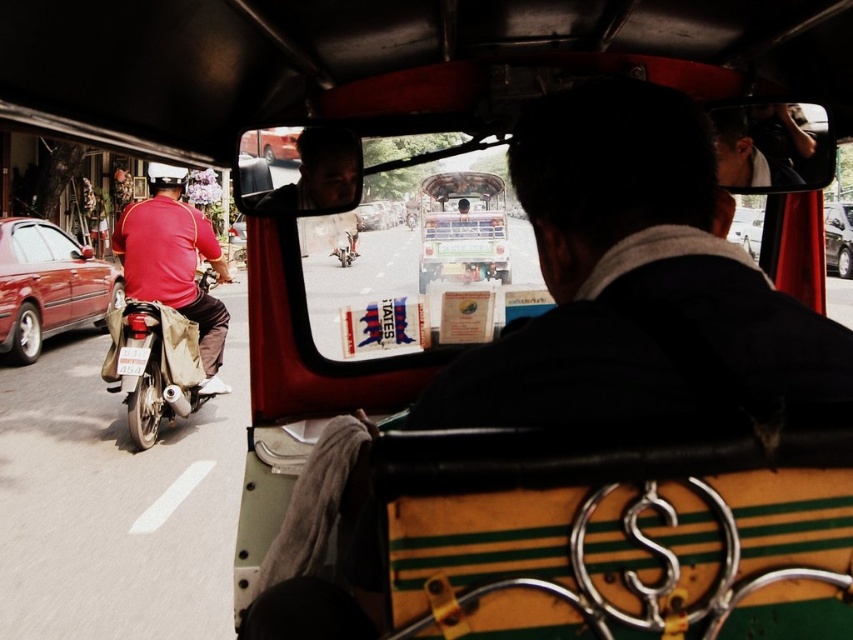
In the scene shown: You are a passenger in a tuk tuk and looking out the windshield. You see two motorcycles, a red matte motorcycle at left and a matte red motorcycle at left. Which one is closer to you?

The red matte motorcycle at left is closer to you because it is positioned over the matte red motorcycle at left, meaning it is in front of it from your perspective.

You are a passenger in a tuk tuk and want to know which vehicle is narrower between the matte red motorcycle at left and the metallic silver car at right. Based on the scene, which one is narrower?

The matte red motorcycle at left is narrower than the metallic silver car at right.